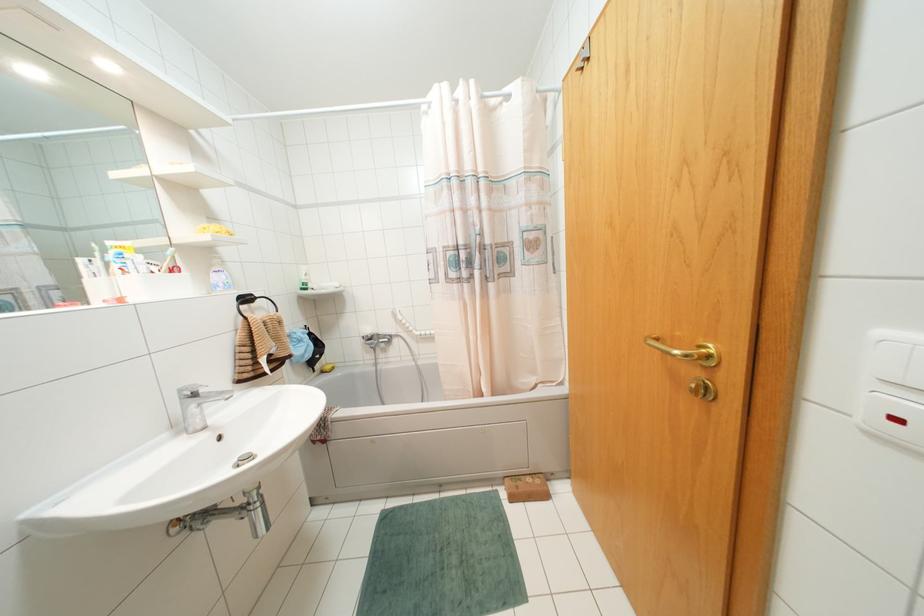
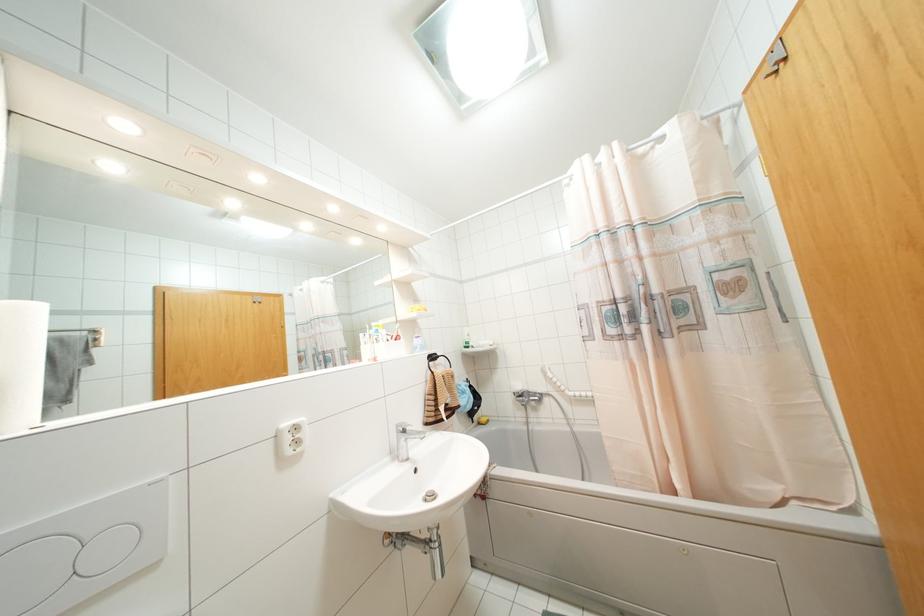
Question: The images are taken continuously from a first-person perspective. In which direction is your viewpoint rotating?

Choices:
 (A) Left
 (B) Right
 (C) Up
 (D) Down

Answer: (A)